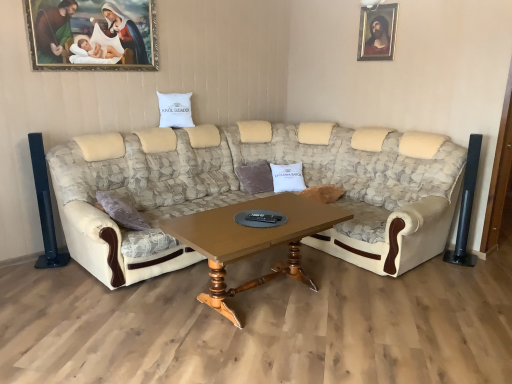
Question: Does wooden framed portrait at upper right, arranged as the 1th picture frame when viewed from the back, have a greater height compared to wooden polished table at center?

Choices:
 (A) no
 (B) yes

Answer: (A)

Question: Is wooden framed portrait at upper right, marked as the 2th picture frame in a left-to-right arrangement, thinner than wooden polished table at center?

Choices:
 (A) yes
 (B) no

Answer: (A)

Question: Is wooden framed portrait at upper right, arranged as the 1th picture frame when viewed from the back, positioned with its back to wooden polished table at center?

Choices:
 (A) yes
 (B) no

Answer: (B)

Question: Considering the relative sizes of wooden framed portrait at upper right, the 2th picture frame viewed from the front, and wooden polished table at center in the image provided, is wooden framed portrait at upper right, the 2th picture frame viewed from the front, shorter than wooden polished table at center?

Choices:
 (A) no
 (B) yes

Answer: (B)

Question: Is wooden framed portrait at upper right, which appears as the first picture frame when viewed from the right, at the left side of wooden polished table at center?

Choices:
 (A) yes
 (B) no

Answer: (B)

Question: Could you tell me if wooden framed portrait at upper right, marked as the 2th picture frame in a left-to-right arrangement, is turned towards wooden polished table at center?

Choices:
 (A) yes
 (B) no

Answer: (B)

Question: Can you confirm if wooden framed painting at upper left, the second picture frame when ordered from right to left, is smaller than beige fabric couch at center?

Choices:
 (A) no
 (B) yes

Answer: (B)

Question: Can you see wooden framed painting at upper left, the second picture frame when ordered from right to left, touching beige fabric couch at center?

Choices:
 (A) no
 (B) yes

Answer: (A)

Question: Considering the relative positions of wooden framed painting at upper left, the 1th picture frame when ordered from left to right, and beige fabric couch at center in the image provided, is wooden framed painting at upper left, the 1th picture frame when ordered from left to right, to the right of beige fabric couch at center from the viewer's perspective?

Choices:
 (A) yes
 (B) no

Answer: (B)

Question: From the image's perspective, is wooden framed painting at upper left, which is the 2th picture frame in back-to-front order, located above beige fabric couch at center?

Choices:
 (A) yes
 (B) no

Answer: (A)

Question: Is wooden framed painting at upper left, which is the 1th picture frame in front-to-back order, positioned in front of beige fabric couch at center?

Choices:
 (A) yes
 (B) no

Answer: (B)

Question: Is wooden framed painting at upper left, which is the 1th picture frame in front-to-back order, oriented towards beige fabric couch at center?

Choices:
 (A) yes
 (B) no

Answer: (B)

Question: From the image's perspective, would you say wooden framed portrait at upper right, marked as the 2th picture frame in a left-to-right arrangement, is shown under wooden framed painting at upper left, which is the 2th picture frame in back-to-front order?

Choices:
 (A) no
 (B) yes

Answer: (A)